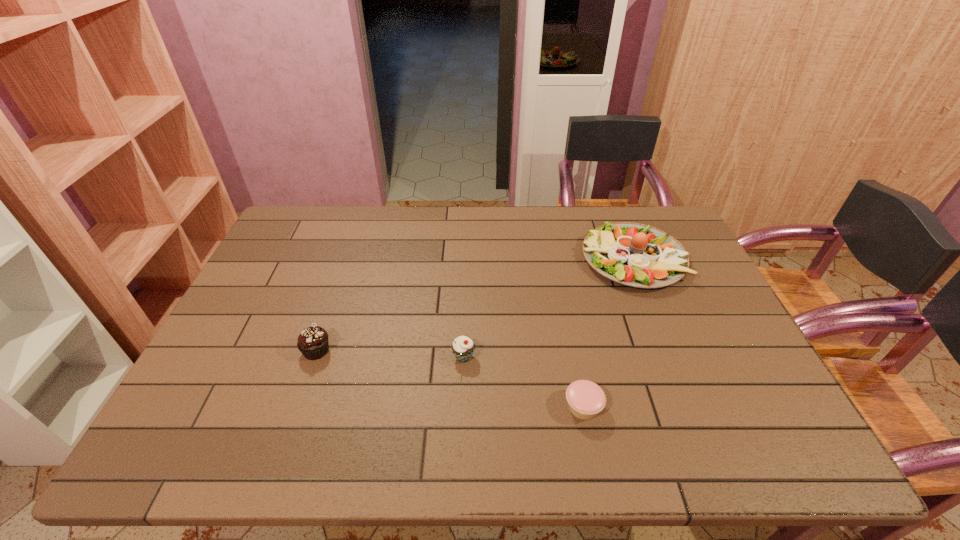
Point out which cupcake is positioned as the nearest to the second cupcake from left to right. Please provide its 2D coordinates. Your answer should be formatted as a tuple, i.e. [(x, y)], where the tuple contains the x and y coordinates of a point satisfying the conditions above.

[(586, 399)]

Locate an element on the screen. This screenshot has width=960, height=540. cupcake that can be found as the closest to the third object from left to right is located at coordinates (463, 347).

Identify the location of free space that satisfies the following two spatial constraints: 1. on the back side of the leftmost object; 2. on the right side of the salad plate. (348, 259).

Where is `blank space that satisfies the following two spatial constraints: 1. on the front side of the third object from left to right; 2. on the right side of the second cupcake from right to left`? blank space that satisfies the following two spatial constraints: 1. on the front side of the third object from left to right; 2. on the right side of the second cupcake from right to left is located at coordinates click(462, 407).